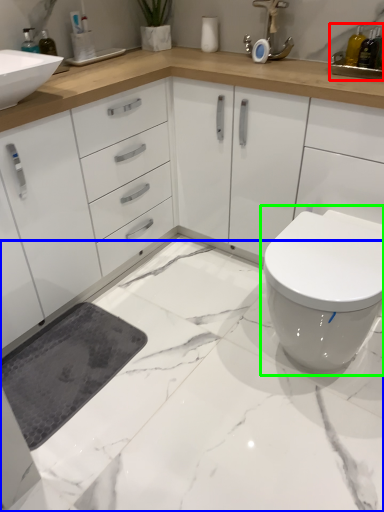
Question: Considering the real-world distances, which object is farthest from sink (highlighted by a red box)? granite (highlighted by a blue box) or toilet (highlighted by a green box)?

Choices:
 (A) granite
 (B) toilet

Answer: (A)